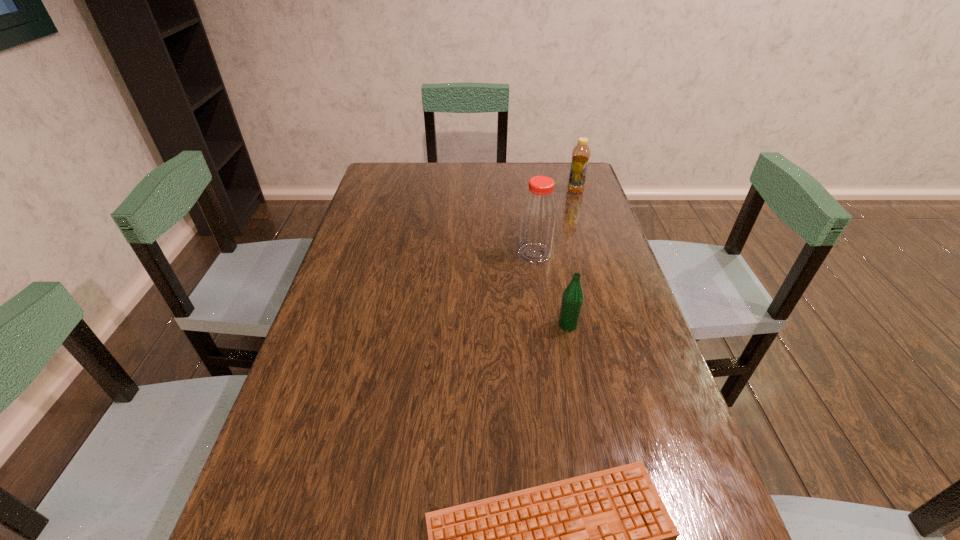
At what (x,y) coordinates should I click in order to perform the action: click on object located in the right edge section of the desktop. Please return your answer as a coordinate pair (x, y). Looking at the image, I should click on point(581,153).

Find the location of a particular element. The width and height of the screenshot is (960, 540). object at the far right corner is located at coordinates (581, 153).

Where is `free space at the far edge`? free space at the far edge is located at coordinates (480, 190).

In the image, there is a desktop. At what (x,y) coordinates should I click in order to perform the action: click on vacant region at the left edge. Please return your answer as a coordinate pair (x, y). This screenshot has height=540, width=960. Looking at the image, I should click on [x=377, y=278].

Where is `vacant space at the right edge of the desktop`? vacant space at the right edge of the desktop is located at coordinates (674, 424).

Where is `vacant space at the far left corner of the desktop`? This screenshot has height=540, width=960. vacant space at the far left corner of the desktop is located at coordinates (388, 176).

Image resolution: width=960 pixels, height=540 pixels. I want to click on free space between the second shortest object and the second tallest object, so click(x=571, y=258).

Locate an element on the screen. free spot between the tallest bottle and the nearest bottle is located at coordinates pyautogui.click(x=551, y=289).

Where is `vacant area that lies between the third tallest object and the third shortest object`? vacant area that lies between the third tallest object and the third shortest object is located at coordinates (571, 258).

You are a GUI agent. You are given a task and a screenshot of the screen. Output one action in this format:
    pyautogui.click(x=<x>, y=<y>)
    Task: Click on the vacant space that is in between the second shortest bottle and the second nearest object
    
    Given the screenshot: What is the action you would take?
    pyautogui.click(x=571, y=258)